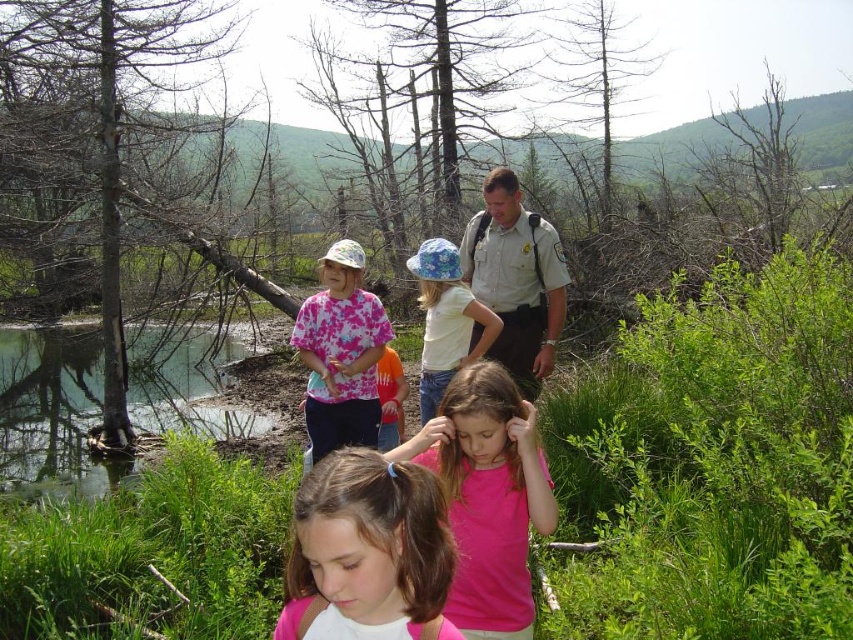
Question: Can you confirm if floral fabric hat at center is positioned above orange cotton shirt at center?

Choices:
 (A) yes
 (B) no

Answer: (A)

Question: Can you confirm if pink matte shirt at center is positioned to the right of khaki uniform at center?

Choices:
 (A) no
 (B) yes

Answer: (A)

Question: Which point is closer to the camera taking this photo?

Choices:
 (A) (318, 451)
 (B) (535, 353)
 (C) (474, 417)

Answer: (C)

Question: Which of the following is the farthest from the observer?

Choices:
 (A) green grassy creek at lower left
 (B) floral fabric hat at center
 (C) tie-dye fabric shirt at center

Answer: (A)

Question: Can you confirm if green grassy creek at lower left is positioned to the left of tie-dye fabric shirt at center?

Choices:
 (A) no
 (B) yes

Answer: (B)

Question: Among these objects, which one is farthest from the camera?

Choices:
 (A) pink matte shirt at center
 (B) green grassy creek at lower left

Answer: (B)